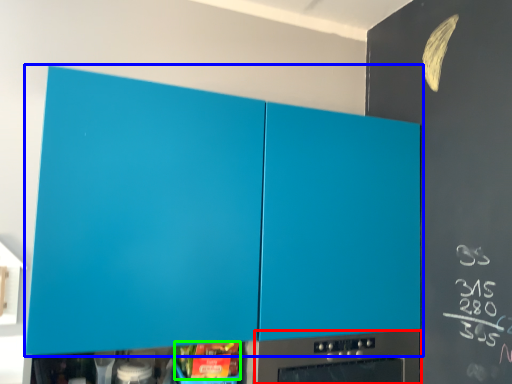
Question: Which object is the farthest from home appliance (highlighted by a red box)? Choose among these: cabinetry (highlighted by a blue box) or food (highlighted by a green box).

Choices:
 (A) cabinetry
 (B) food

Answer: (A)